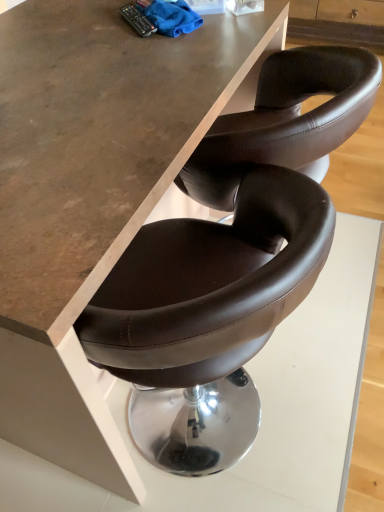
Where is `vacant space in front of blue microfiber cloth at upper center`? vacant space in front of blue microfiber cloth at upper center is located at coordinates (175, 53).